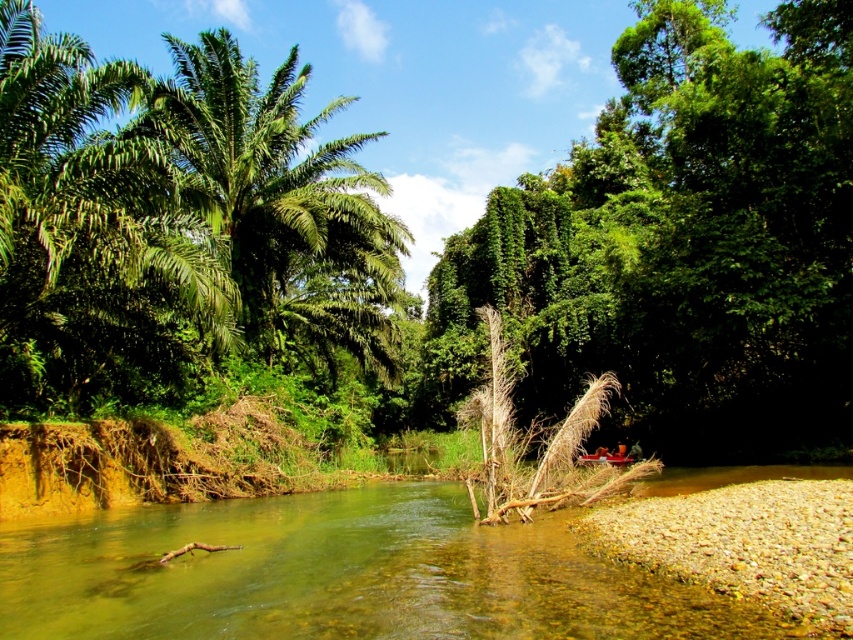
Question: Which object is farther from the camera taking this photo?

Choices:
 (A) green leafy palm tree at upper left
 (B) clear water at center
 (C) green leafy tree at center

Answer: (C)

Question: Can you confirm if clear water at center is bigger than green leafy palm tree at upper left?

Choices:
 (A) no
 (B) yes

Answer: (A)

Question: Considering the real-world distances, which object is closest to the green leafy tree at center?

Choices:
 (A) green leafy palm tree at upper left
 (B) clear water at center

Answer: (A)

Question: Is green leafy tree at center positioned in front of green leafy palm tree at upper left?

Choices:
 (A) no
 (B) yes

Answer: (A)

Question: Can you confirm if clear water at center is positioned above green leafy palm tree at upper left?

Choices:
 (A) yes
 (B) no

Answer: (B)

Question: Considering the real-world distances, which object is farthest from the green leafy tree at center?

Choices:
 (A) green leafy palm tree at upper left
 (B) clear water at center

Answer: (B)